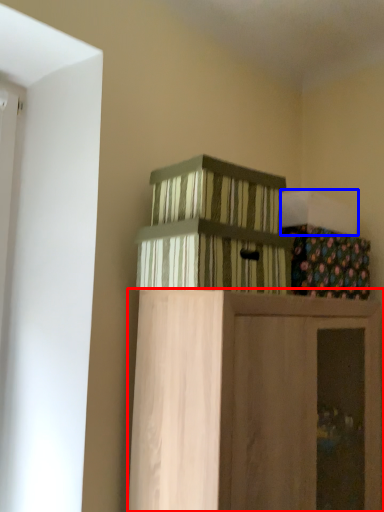
Question: Which of the following is the farthest to the observer, furniture (highlighted by a red box) or box (highlighted by a blue box)?

Choices:
 (A) furniture
 (B) box

Answer: (B)